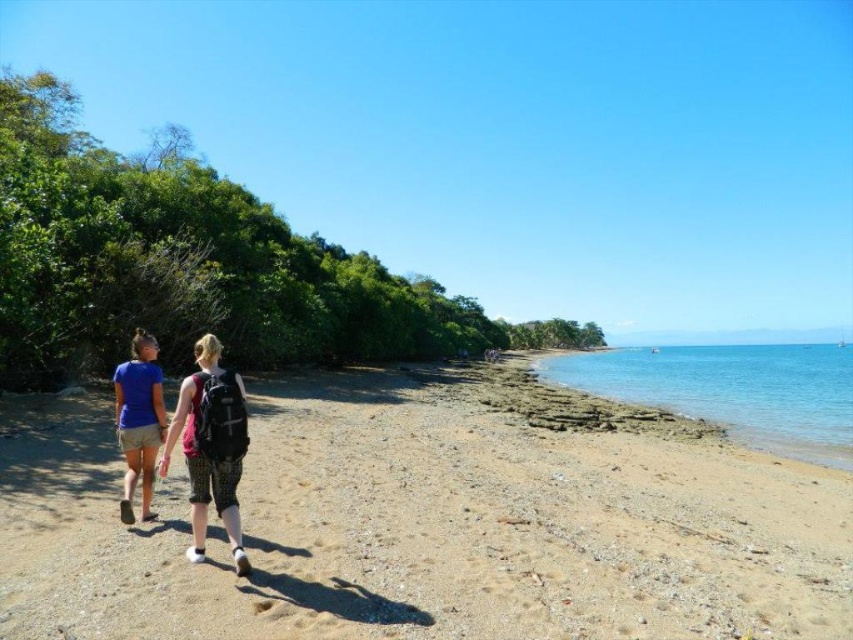
Question: Can you confirm if brown sandy beach at center is positioned below blue fabric shorts at lower left?

Choices:
 (A) no
 (B) yes

Answer: (B)

Question: Where is matte black backpack at lower left located in relation to blue fabric shorts at lower left in the image?

Choices:
 (A) left
 (B) right

Answer: (A)

Question: Which point is farther to the camera?

Choices:
 (A) brown sandy beach at center
 (B) matte black backpack at lower left
 (C) blue fabric shorts at lower left
 (D) clear blue water at right

Answer: (D)

Question: Based on their relative distances, which object is farther from the clear blue water at right?

Choices:
 (A) brown sandy beach at center
 (B) matte black backpack at lower left
 (C) blue fabric shorts at lower left

Answer: (C)

Question: Among these points, which one is farthest from the camera?

Choices:
 (A) (809, 451)
 (B) (445, 371)
 (C) (247, 426)

Answer: (B)

Question: Does brown sandy beach at center lie behind matte black backpack at lower left?

Choices:
 (A) no
 (B) yes

Answer: (A)